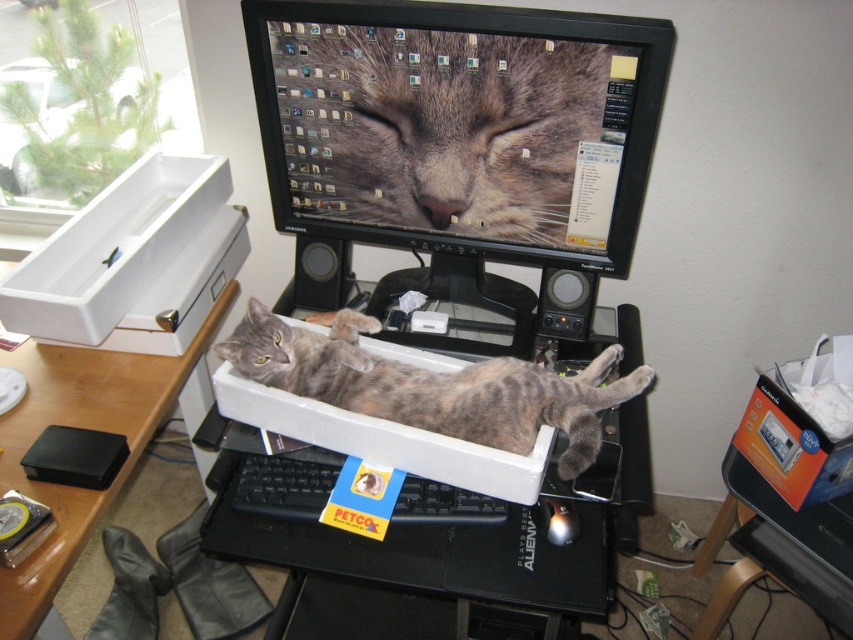
You are a delivery robot tasked with placing a small package on the desk. The desk has a gray fur cat at center. Where should you place the package to avoid disturbing the cat?

Place the package away from the gray fur cat at center, preferably near the edges of the desk where the cat is not located.

You are a delivery person who just arrived at the office and need to place a new orange cardboard box at lower right on the desk without disturbing the gray fur cat at center. Is the current desk space sufficient to accommodate both the cat and the new box?

The gray fur cat at center is wider than the orange cardboard box at lower right. Since the cat is already occupying the center of the desk, there might not be enough space to add the new box without overlapping, so the desk space may not be sufficient.

You are a delivery robot entering the room and need to place a package on the desk. The desk has two points marked for package placement. The first point is at coordinates point (x=378, y=202) and the second is at point (x=486, y=428). Which point should you choose to avoid blocking the cat in the white plastic storage box?

You should choose point (x=486, y=428) because point (x=378, y=202) is behind point (x=486, y=428), meaning placing the package there would block the cat in the white plastic storage box.